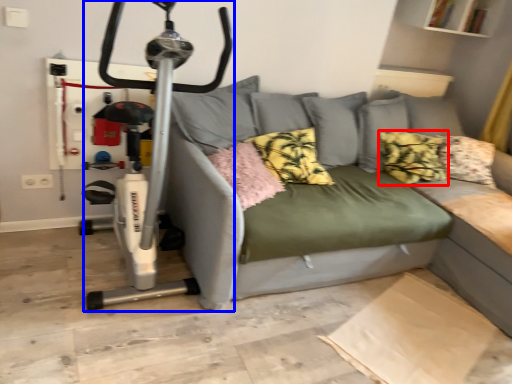
Question: Among these objects, which one is nearest to the camera, pillow (highlighted by a red box) or sport equipment (highlighted by a blue box)?

Choices:
 (A) pillow
 (B) sport equipment

Answer: (B)